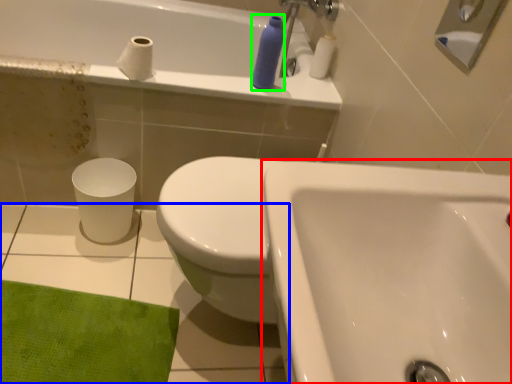
Question: Which object is positioned closest to sink (highlighted by a red box)? Select from ceramic tile (highlighted by a blue box) and toiletry (highlighted by a green box).

Choices:
 (A) ceramic tile
 (B) toiletry

Answer: (A)